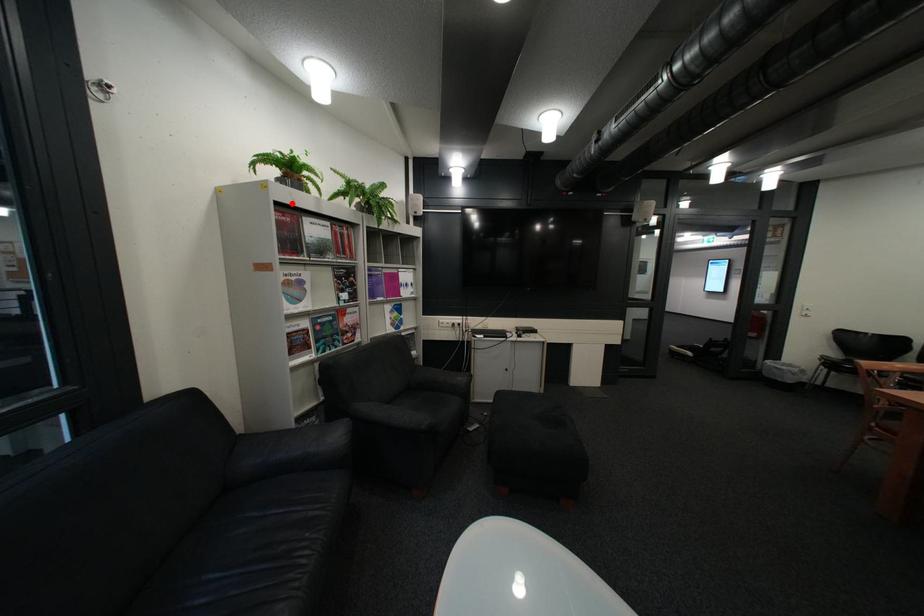
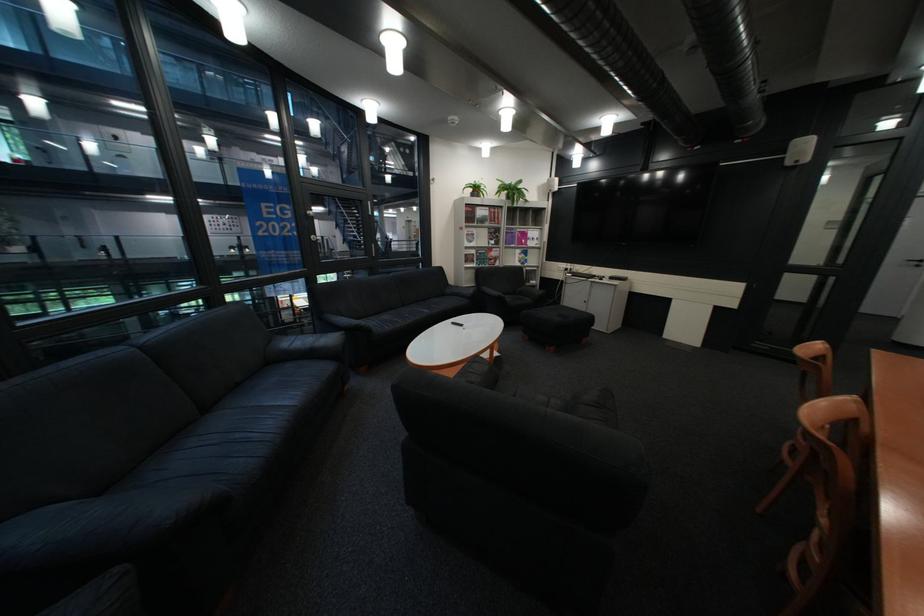
Question: I am providing you with two images of the same scene from different viewpoints. Given a red point in image1, look at the same physical point in image2. Is it:

Choices:
 (A) Closer to the viewpoint
 (B) Farther from the viewpoint

Answer: (A)